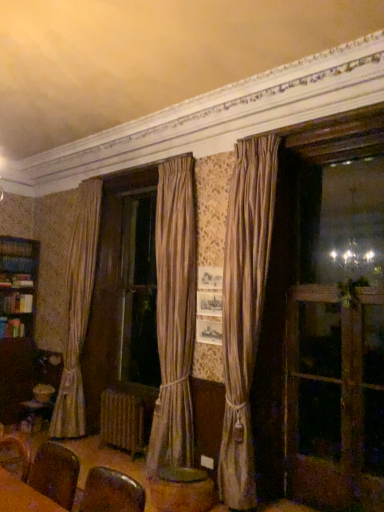
What do you see at coordinates (55, 473) in the screenshot? Image resolution: width=384 pixels, height=512 pixels. I see `brown leather armchair at lower left` at bounding box center [55, 473].

I want to click on wooden round table at center, so click(181, 490).

What do you see at coordinates (181, 490) in the screenshot? Image resolution: width=384 pixels, height=512 pixels. I see `wooden round table at center` at bounding box center [181, 490].

Image resolution: width=384 pixels, height=512 pixels. Identify the location of silky beige curtain at center. point(244,308).

Between wooden round table at center and wooden screen door at right, which one appears on the left side from the viewer's perspective?

wooden round table at center.

From a real-world perspective, is wooden round table at center located higher than wooden screen door at right?

No, from a real-world perspective, wooden round table at center is not over wooden screen door at right

In the scene shown: Is wooden round table at center located outside wooden screen door at right?

Yes, wooden round table at center is not within wooden screen door at right.

Identify the location of round table behind the wooden screen door at right. This screenshot has height=512, width=384. (181, 490).

Is the position of silky beige curtain at center more distant than that of brown leather armchair at lower left?

Yes.

From a real-world perspective, is silky beige curtain at center located beneath brown leather armchair at lower left?

No, from a real-world perspective, silky beige curtain at center is not below brown leather armchair at lower left.

Does silky beige curtain at center have a greater height compared to brown leather armchair at lower left?

Yes, silky beige curtain at center is taller than brown leather armchair at lower left.

In terms of height, does brown leather armchair at lower left look taller or shorter compared to silky beige curtain at center?

Considering their sizes, brown leather armchair at lower left has less height than silky beige curtain at center.

Is brown leather armchair at lower left wider or thinner than silky beige curtain at center?

Considering their sizes, brown leather armchair at lower left looks broader than silky beige curtain at center.

From a real-world perspective, is brown leather armchair at lower left physically located above or below silky beige curtain at center?

brown leather armchair at lower left is below silky beige curtain at center.

Is point (30, 474) closer to viewer compared to point (274, 210)?

Yes, it is.

What's the angular difference between white textured radiator at lower center and wooden screen door at right's facing directions?

They differ by 0.113 degrees in their facing directions.

Is white textured radiator at lower center facing towards wooden screen door at right?

No.

Between white textured radiator at lower center and wooden screen door at right, which one has smaller width?

Thinner between the two is wooden screen door at right.

Considering the positions of point (147, 426) and point (382, 441), is point (147, 426) closer or farther from the camera than point (382, 441)?

Point (147, 426) is farther from the camera than point (382, 441).

How different are the orientations of white textured radiator at lower center and silky beige curtain at center in degrees?

The facing directions of white textured radiator at lower center and silky beige curtain at center are 3.83 degrees apart.

From their relative heights in the image, would you say white textured radiator at lower center is taller or shorter than silky beige curtain at center?

In the image, white textured radiator at lower center appears to be shorter than silky beige curtain at center.

From the image's perspective, is white textured radiator at lower center beneath silky beige curtain at center?

Yes.

Does white textured radiator at lower center have a greater width compared to silky beige curtain at center?

No.

Is the surface of wooden round table at center in direct contact with white textured radiator at lower center?

wooden round table at center is not next to white textured radiator at lower center, and they're not touching.

Image resolution: width=384 pixels, height=512 pixels. I want to click on round table located in front of the white textured radiator at lower center, so click(x=181, y=490).

From the image's perspective, is wooden round table at center located above white textured radiator at lower center?

No, from the image's perspective, wooden round table at center is not above white textured radiator at lower center.

Considering the relative sizes of wooden round table at center and white textured radiator at lower center in the image provided, is wooden round table at center bigger than white textured radiator at lower center?

No.

Which point is more forward, (x=325, y=367) or (x=235, y=394)?

The point (x=235, y=394) is more forward.

Would you consider wooden screen door at right to be distant from silky beige curtain at center?

They are positioned close to each other.

Is wooden screen door at right aimed at silky beige curtain at center?

No, wooden screen door at right is not turned towards silky beige curtain at center.

From a real-world perspective, is wooden screen door at right over silky beige curtain at center?

No, from a real-world perspective, wooden screen door at right is not over silky beige curtain at center

Locate an element on the screen. round table on the left side of wooden screen door at right is located at coordinates (181, 490).

Image resolution: width=384 pixels, height=512 pixels. Identify the location of armchair that is in front of the silky beige curtain at center. (55, 473).

From the image, which object appears to be nearer to wooden round table at center, brown leather armchair at lower left or wooden screen door at right?

Based on the image, wooden screen door at right appears to be nearer to wooden round table at center.

Which object lies nearer to the anchor point wooden screen door at right, brown leather armchair at lower left or wooden round table at center?

wooden round table at center lies closer to wooden screen door at right than the other object.

From the image, which object appears to be farther from wooden screen door at right, wooden round table at center or brown leather armchair at lower left?

brown leather armchair at lower left is positioned further to the anchor wooden screen door at right.

Considering their positions, is silky beige curtain at center positioned further to wooden round table at center than wooden screen door at right?

Based on the image, wooden screen door at right appears to be further to wooden round table at center.

Estimate the real-world distances between objects in this image. Which object is further from silky beige curtain at center, wooden round table at center or white textured radiator at lower center?

white textured radiator at lower center is positioned further to the anchor silky beige curtain at center.

Based on the photo, estimate the real-world distances between objects in this image. Which object is further from silky beige curtain at center, brown leather armchair at lower left or wooden round table at center?

brown leather armchair at lower left is further to silky beige curtain at center.

When comparing their distances from wooden round table at center, does wooden screen door at right or silky beige curtain at center seem further?

wooden screen door at right lies further to wooden round table at center than the other object.

Looking at this image, from the image, which object appears to be nearer to white textured radiator at lower center, wooden screen door at right or wooden round table at center?

The object closer to white textured radiator at lower center is wooden round table at center.

I want to click on screen door between brown leather armchair at lower left and white textured radiator at lower center along the z-axis, so click(x=334, y=398).

Find the location of `screen door between silky beige curtain at center and wooden round table at center in the up-down direction`. screen door between silky beige curtain at center and wooden round table at center in the up-down direction is located at coordinates (334, 398).

Identify the location of round table between brown leather armchair at lower left and wooden screen door at right in the horizontal direction. The width and height of the screenshot is (384, 512). [181, 490].

Identify the location of radiator between silky beige curtain at center and wooden round table at center from top to bottom. The width and height of the screenshot is (384, 512). (124, 420).